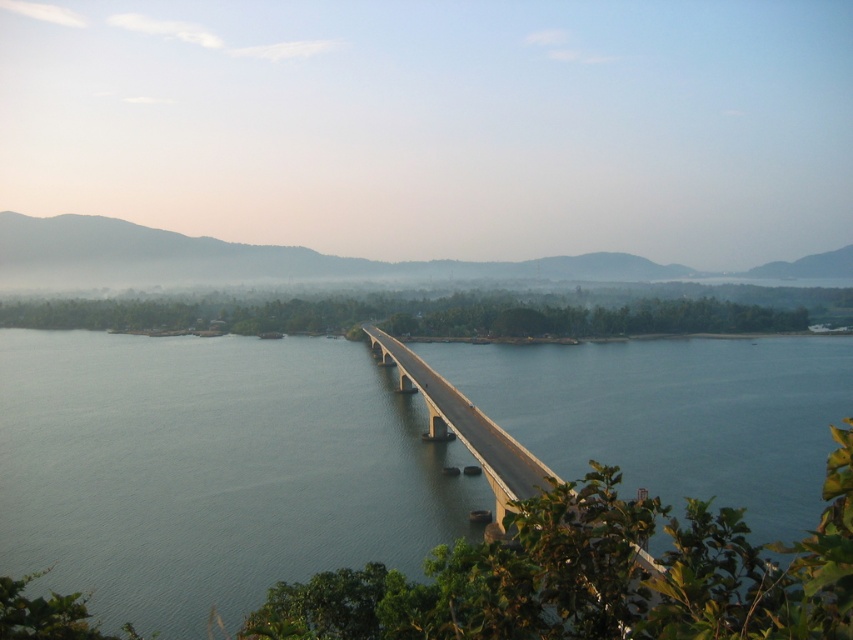
Question: Which of the following is the farthest from the observer?

Choices:
 (A) clear blue water at center
 (B) concrete bridge at center

Answer: (B)

Question: Does clear blue water at center have a larger size compared to concrete bridge at center?

Choices:
 (A) yes
 (B) no

Answer: (A)

Question: Is clear blue water at center positioned behind concrete bridge at center?

Choices:
 (A) yes
 (B) no

Answer: (B)

Question: Which object appears closest to the camera in this image?

Choices:
 (A) clear blue water at center
 (B) concrete bridge at center

Answer: (A)

Question: Is clear blue water at center bigger than concrete bridge at center?

Choices:
 (A) no
 (B) yes

Answer: (B)